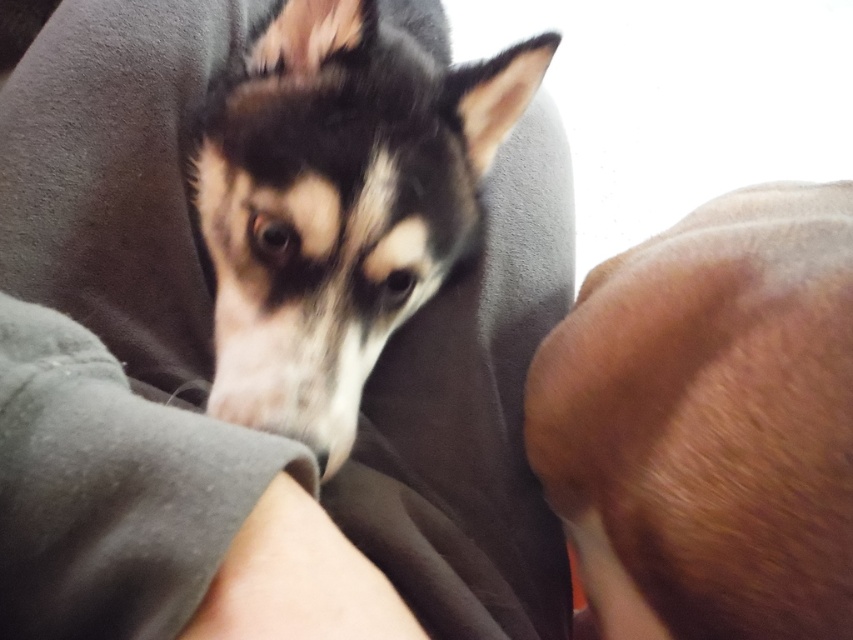
You are a photographer holding a camera. You want to take a photo of the brown fur at lower right and the black fur at upper left. How far apart should you position the two subjects to ensure they are both in focus?

The brown fur at lower right and the black fur at upper left are 15.01 inches apart. To ensure both are in focus, position them at least 15.01 inches apart.

You are holding a small toy that is 12 inches long. You want to place it so that it reaches from your current position to the point marked at coordinates point (807, 595). Will the toy be long enough to cover that distance?

The point (807, 595) is 15.88 inches away from the viewer. Since the toy is only 12 inches long, it will not be long enough to cover the distance.